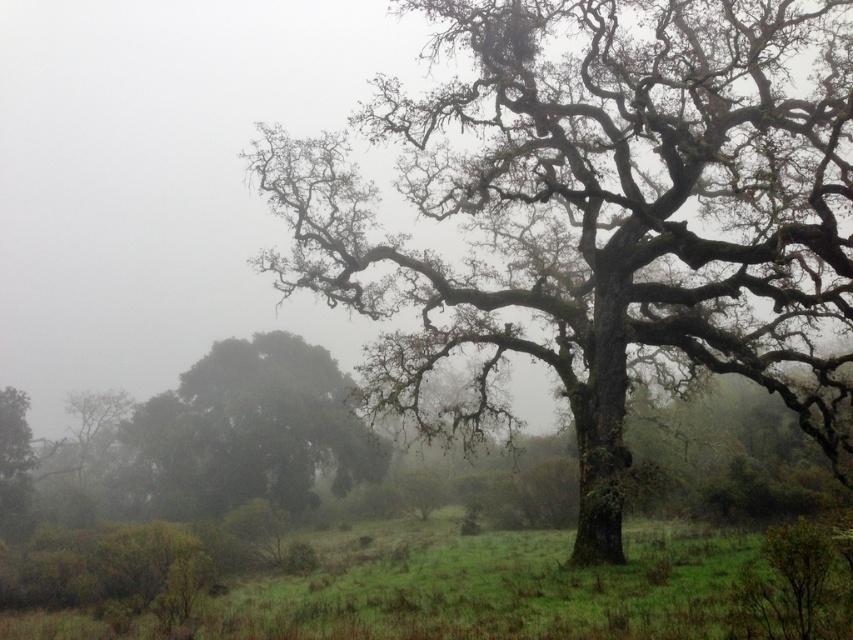
Can you confirm if green mossy tree at center is wider than green leafy tree at left?

Indeed, green mossy tree at center has a greater width compared to green leafy tree at left.

Which is in front, point (563, 259) or point (213, 416)?

Point (563, 259)

Between point (488, 305) and point (270, 492), which one is positioned behind?

Point (270, 492)

What are the coordinates of `green mossy tree at center` in the screenshot? It's located at (602, 212).